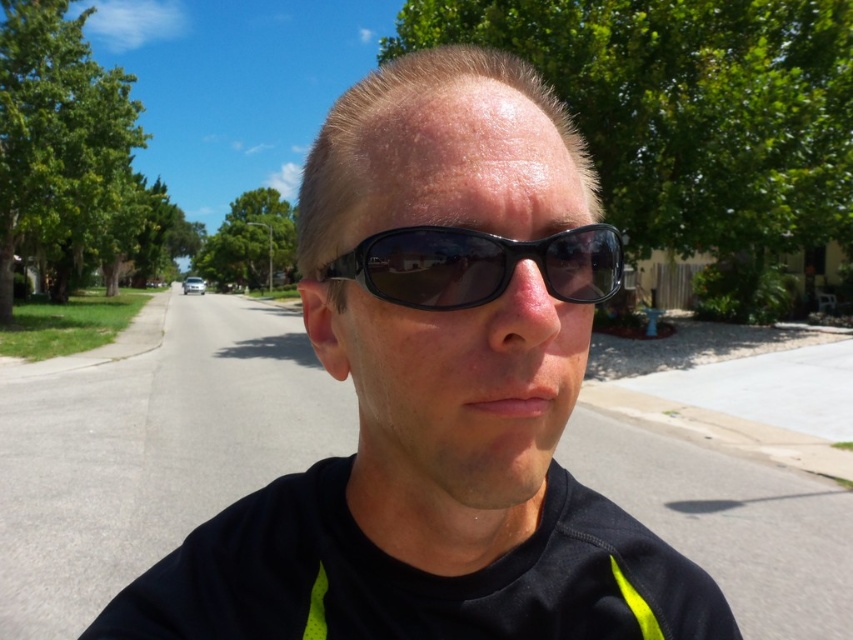
Question: Is black matte sunglasses at center smaller than black plastic sunglasses at center?

Choices:
 (A) no
 (B) yes

Answer: (A)

Question: Which point is farther from the camera taking this photo?

Choices:
 (A) (403, 387)
 (B) (399, 252)

Answer: (A)

Question: Which point appears farthest from the camera in this image?

Choices:
 (A) (396, 280)
 (B) (474, 618)

Answer: (B)

Question: Which of the following is the closest to the observer?

Choices:
 (A) black plastic sunglasses at center
 (B) black matte sunglasses at center

Answer: (A)

Question: Where is black matte sunglasses at center located in relation to black plastic sunglasses at center in the image?

Choices:
 (A) left
 (B) right

Answer: (A)

Question: In this image, where is black matte sunglasses at center located relative to black plastic sunglasses at center?

Choices:
 (A) below
 (B) above

Answer: (A)